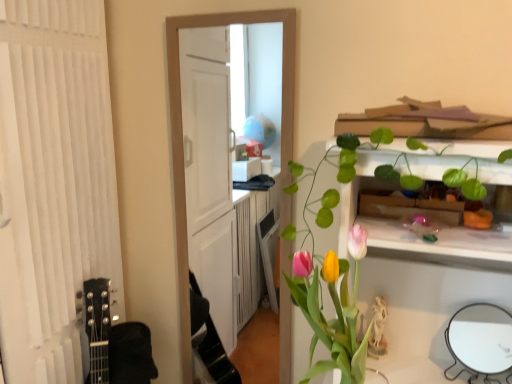
Identify the location of white glossy mirror at lower right. (481, 338).

Image resolution: width=512 pixels, height=384 pixels. Describe the element at coordinates (481, 338) in the screenshot. I see `white glossy mirror at lower right` at that location.

At what (x,y) coordinates should I click in order to perform the action: click on matte plastic vase with tulips at center. Please return your answer as a coordinate pair (x, y). The height and width of the screenshot is (384, 512). Looking at the image, I should click on (335, 309).

What do you see at coordinates (335, 309) in the screenshot? I see `matte plastic vase with tulips at center` at bounding box center [335, 309].

The height and width of the screenshot is (384, 512). In order to click on white glossy mirror at lower right in this screenshot , I will do `click(481, 338)`.

Does matte plastic vase with tulips at center appear on the right side of white glossy mirror at lower right?

Incorrect, matte plastic vase with tulips at center is not on the right side of white glossy mirror at lower right.

Between matte plastic vase with tulips at center and white glossy mirror at lower right, which one is positioned behind?

white glossy mirror at lower right.

Between point (361, 258) and point (460, 324), which one is positioned behind?

Positioned behind is point (460, 324).

From the image's perspective, who appears lower, matte plastic vase with tulips at center or white glossy mirror at lower right?

white glossy mirror at lower right is shown below in the image.

From a real-world perspective, is matte plastic vase with tulips at center physically below white glossy mirror at lower right?

Incorrect, from a real-world perspective, matte plastic vase with tulips at center is higher than white glossy mirror at lower right.

Can you confirm if matte plastic vase with tulips at center is wider than white glossy mirror at lower right?

Yes.

Which of these two, matte plastic vase with tulips at center or white glossy mirror at lower right, stands taller?

Standing taller between the two is matte plastic vase with tulips at center.

Between matte plastic vase with tulips at center and white glossy mirror at lower right, which one has smaller size?

white glossy mirror at lower right.

Choose the correct answer: Is matte plastic vase with tulips at center inside white glossy mirror at lower right or outside it?

matte plastic vase with tulips at center is outside white glossy mirror at lower right.

Is matte plastic vase with tulips at center far from white glossy mirror at lower right?

No, matte plastic vase with tulips at center is not far away from white glossy mirror at lower right.

Is matte plastic vase with tulips at center oriented towards white glossy mirror at lower right?

No, matte plastic vase with tulips at center is not oriented towards white glossy mirror at lower right.

What's the angular difference between matte plastic vase with tulips at center and white glossy mirror at lower right's facing directions?

The angle between the facing direction of matte plastic vase with tulips at center and the facing direction of white glossy mirror at lower right is 0.642 degrees.

In the image, there is a matte plastic vase with tulips at center. Where is `mirror below it (from the image's perspective)`? mirror below it (from the image's perspective) is located at coordinates pos(481,338).

Considering the relative positions of white glossy mirror at lower right and matte plastic vase with tulips at center in the image provided, is white glossy mirror at lower right to the right of matte plastic vase with tulips at center from the viewer's perspective?

Indeed, white glossy mirror at lower right is positioned on the right side of matte plastic vase with tulips at center.

Which object is closer to the camera, white glossy mirror at lower right or matte plastic vase with tulips at center?

Positioned in front is matte plastic vase with tulips at center.

Which is less distant, (x=479, y=365) or (x=346, y=381)?

Clearly, point (x=479, y=365) is more distant from the camera than point (x=346, y=381).

From the picture: From the image's perspective, is white glossy mirror at lower right above or below matte plastic vase with tulips at center?

white glossy mirror at lower right is below matte plastic vase with tulips at center.

From a real-world perspective, which is physically below, white glossy mirror at lower right or matte plastic vase with tulips at center?

white glossy mirror at lower right is physically lower.

Based on the photo, looking at their sizes, would you say white glossy mirror at lower right is wider or thinner than matte plastic vase with tulips at center?

In the image, white glossy mirror at lower right appears to be more narrow than matte plastic vase with tulips at center.

Who is shorter, white glossy mirror at lower right or matte plastic vase with tulips at center?

white glossy mirror at lower right.

In the scene shown: Can you confirm if white glossy mirror at lower right is smaller than matte plastic vase with tulips at center?

Yes, white glossy mirror at lower right is smaller than matte plastic vase with tulips at center.

Is matte plastic vase with tulips at center completely or partially inside white glossy mirror at lower right?

No, matte plastic vase with tulips at center is not surrounded by white glossy mirror at lower right.

Is white glossy mirror at lower right directly adjacent to matte plastic vase with tulips at center?

No.

Is white glossy mirror at lower right facing away from matte plastic vase with tulips at center?

white glossy mirror at lower right is not turned away from matte plastic vase with tulips at center.

What's the angular difference between white glossy mirror at lower right and matte plastic vase with tulips at center's facing directions?

0.642 degrees.

Where is `floral arrangement located above the white glossy mirror at lower right (from a real-world perspective)`? The image size is (512, 384). floral arrangement located above the white glossy mirror at lower right (from a real-world perspective) is located at coordinates (335, 309).

Locate an element on the screen. The width and height of the screenshot is (512, 384). mirror on the right of matte plastic vase with tulips at center is located at coordinates coord(481,338).

Where is `floral arrangement above the white glossy mirror at lower right (from the image's perspective)`? floral arrangement above the white glossy mirror at lower right (from the image's perspective) is located at coordinates (335, 309).